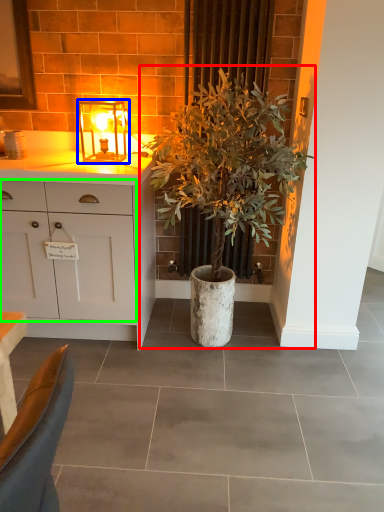
Question: Which object is the closest to the houseplant (highlighted by a red box)? Choose among these: lamp (highlighted by a blue box) or cabinetry (highlighted by a green box).

Choices:
 (A) lamp
 (B) cabinetry

Answer: (B)